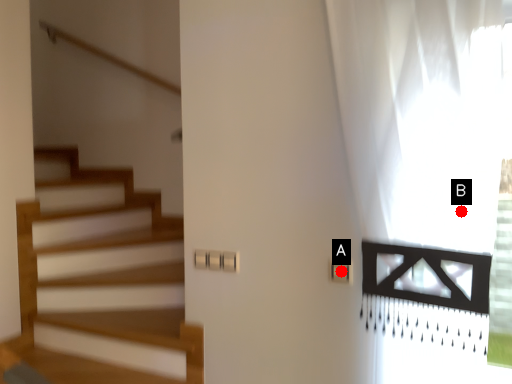
Question: Two points are circled on the image, labeled by A and B beside each circle. Which point is closer to the camera?

Choices:
 (A) A is closer
 (B) B is closer

Answer: (B)